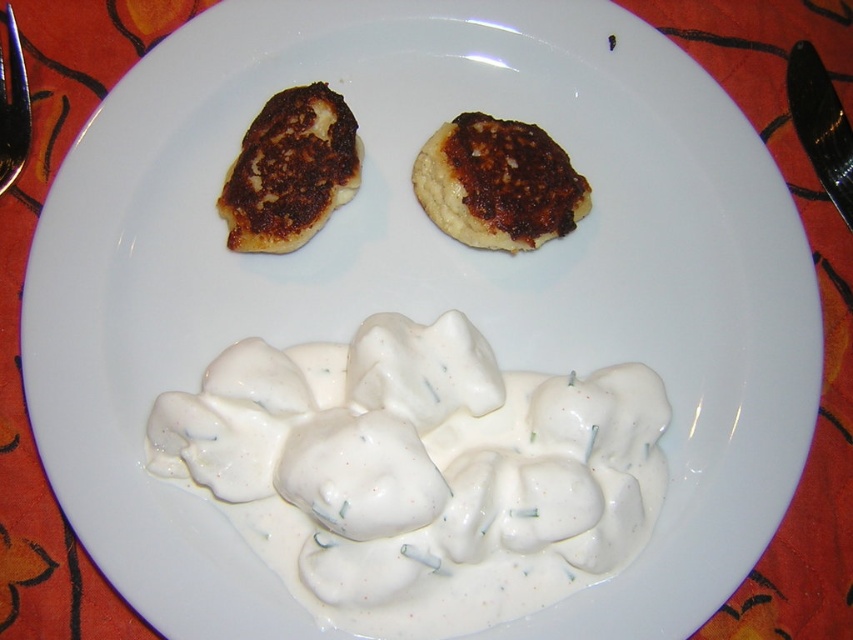
Is brown crispy pancake at upper center to the left of metallic silver fork at upper left from the viewer's perspective?

Incorrect, brown crispy pancake at upper center is not on the left side of metallic silver fork at upper left.

Is brown crispy pancake at upper center further to camera compared to metallic silver fork at upper left?

Yes.

You are a GUI agent. You are given a task and a screenshot of the screen. Output one action in this format:
    pyautogui.click(x=<x>, y=<y>)
    Task: Click on the brown crispy pancake at upper center
    
    Given the screenshot: What is the action you would take?
    pyautogui.click(x=498, y=182)

Consider the image. Is white creamy sauce at center bigger than brown crispy pancake at upper center?

Indeed, white creamy sauce at center has a larger size compared to brown crispy pancake at upper center.

Between point (302, 445) and point (438, 225), which one is positioned behind?

The point (438, 225) is more distant.

Between point (572, 518) and point (494, 179), which one is positioned in front?

Point (572, 518)

Identify the location of white creamy sauce at center. The image size is (853, 640). (419, 472).

Does white creamy sauce at center appear on the left side of metallic silver fork at upper left?

In fact, white creamy sauce at center is to the right of metallic silver fork at upper left.

How far apart are white creamy sauce at center and metallic silver fork at upper left?

They are 24.34 inches apart.

Between point (618, 504) and point (10, 61), which one is positioned behind?

The point (10, 61) is behind.

At what (x,y) coordinates should I click in order to perform the action: click on white creamy sauce at center. Please return your answer as a coordinate pair (x, y). Image resolution: width=853 pixels, height=640 pixels. Looking at the image, I should click on (419, 472).